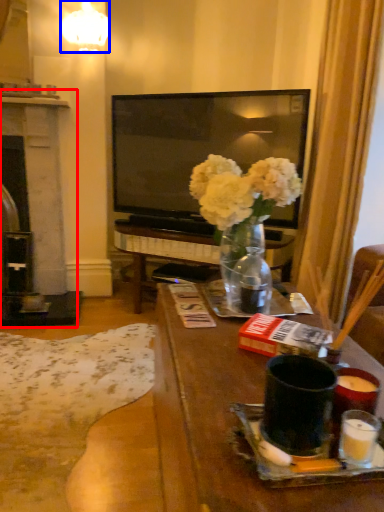
Question: Which object is closer to the camera taking this photo, fireplace (highlighted by a red box) or lamp (highlighted by a blue box)?

Choices:
 (A) fireplace
 (B) lamp

Answer: (B)